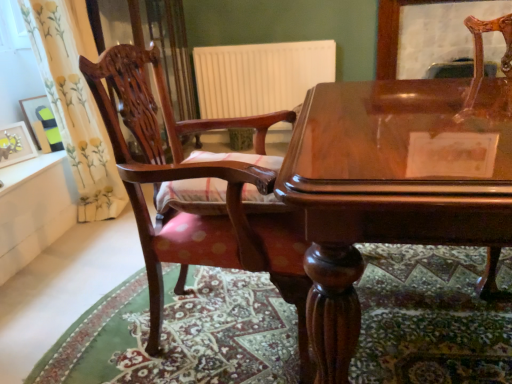
Question: Is matte yellow picture frame at left, which is the first picture frame from front to back, far from white matte radiator at center?

Choices:
 (A) yes
 (B) no

Answer: (A)

Question: Does matte yellow picture frame at left, which is the first picture frame from front to back, have a larger size compared to white matte radiator at center?

Choices:
 (A) no
 (B) yes

Answer: (A)

Question: Does matte yellow picture frame at left, which is the first picture frame from front to back, have a greater width compared to white matte radiator at center?

Choices:
 (A) yes
 (B) no

Answer: (B)

Question: Can you confirm if matte yellow picture frame at left, which is the first picture frame from front to back, is shorter than white matte radiator at center?

Choices:
 (A) yes
 (B) no

Answer: (A)

Question: Does matte yellow picture frame at left, the 2th picture frame in the back-to-front sequence, appear on the right side of white matte radiator at center?

Choices:
 (A) yes
 (B) no

Answer: (B)

Question: Is white matte radiator at center at the back of matte yellow picture frame at left, the 2th picture frame in the back-to-front sequence?

Choices:
 (A) no
 (B) yes

Answer: (A)

Question: Can you confirm if mahogany wood chair at left is smaller than white matte radiator at center?

Choices:
 (A) no
 (B) yes

Answer: (A)

Question: Is mahogany wood chair at left aimed at white matte radiator at center?

Choices:
 (A) no
 (B) yes

Answer: (A)

Question: Is mahogany wood chair at left placed right next to white matte radiator at center?

Choices:
 (A) no
 (B) yes

Answer: (A)

Question: From a real-world perspective, is mahogany wood chair at left under white matte radiator at center?

Choices:
 (A) no
 (B) yes

Answer: (B)

Question: Does mahogany wood chair at left have a larger size compared to white matte radiator at center?

Choices:
 (A) yes
 (B) no

Answer: (A)

Question: Is mahogany wood chair at left completely or partially outside of white matte radiator at center?

Choices:
 (A) no
 (B) yes

Answer: (B)

Question: Is glossy wood table at center oriented away from mahogany wood chair at left?

Choices:
 (A) yes
 (B) no

Answer: (B)